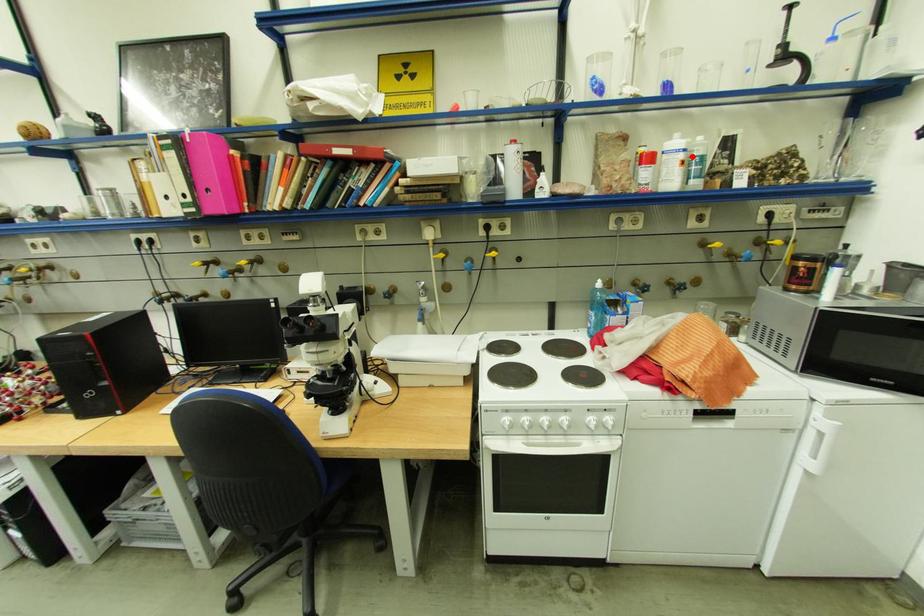
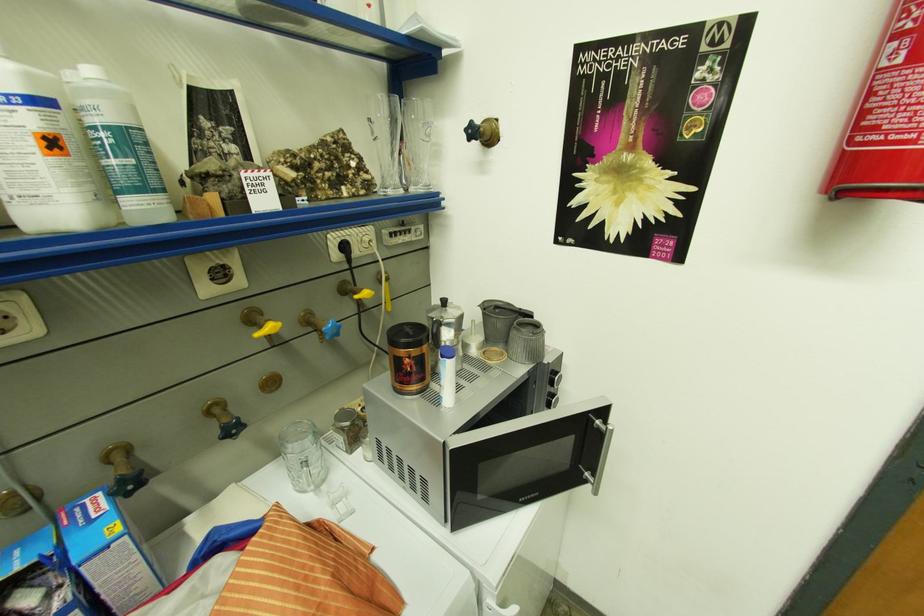
Where in the second image is the point corresponding to the highlighted location from the first image?

(43, 121)